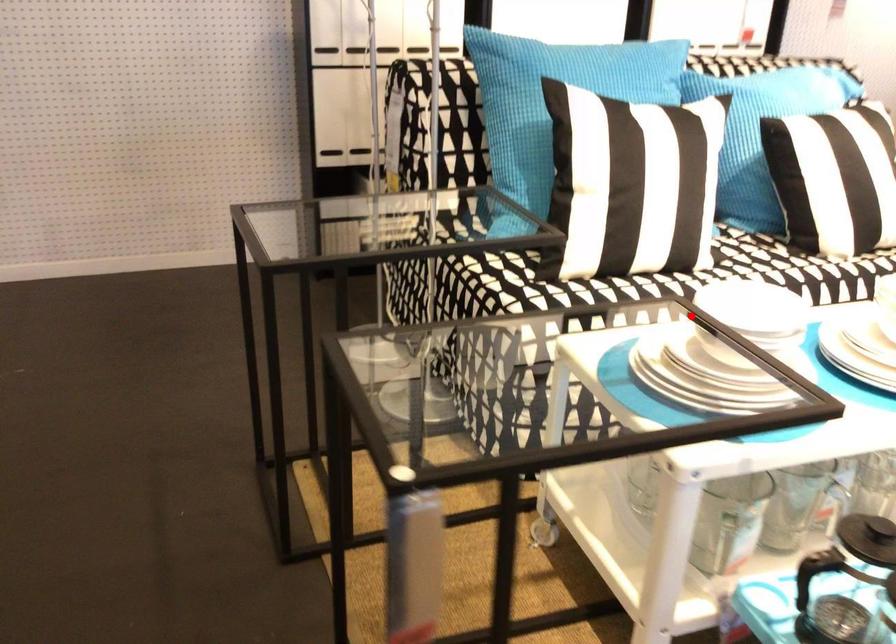
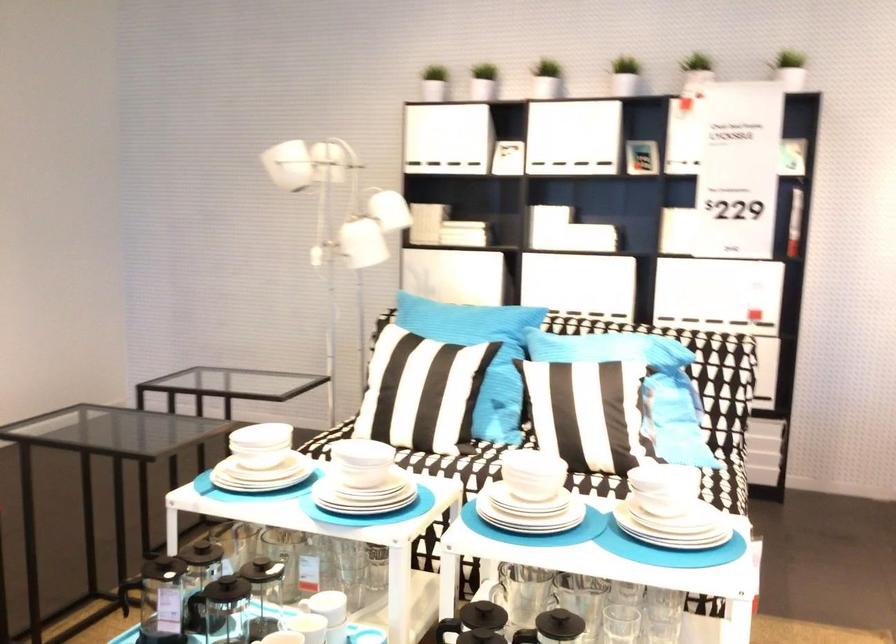
Question: A red point is marked in image1. In image2, is the corresponding 3D point closer to the camera or farther? Reply with the corresponding letter.

Choices:
 (A) The corresponding 3D point is closer.
 (B) The corresponding 3D point is farther.

Answer: (B)